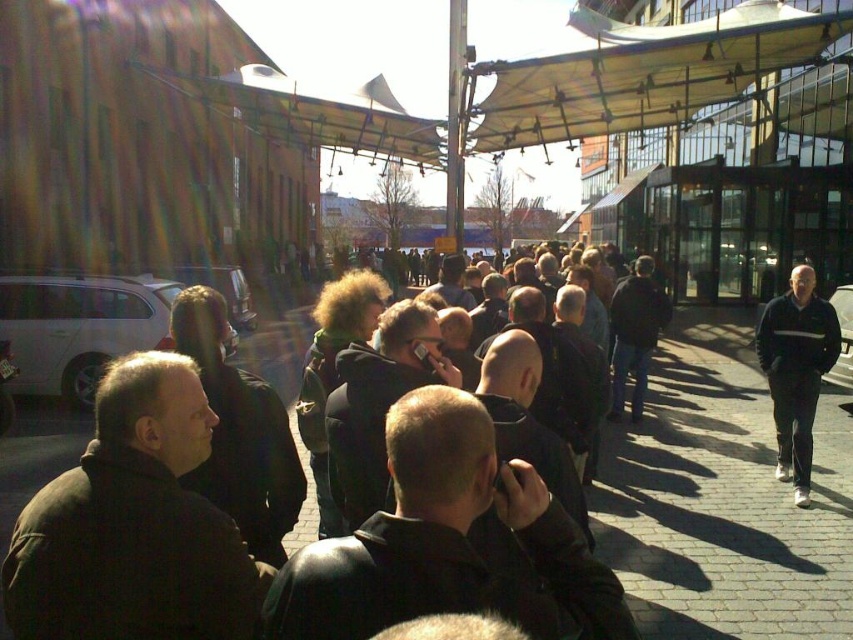
Question: Which of these objects is positioned closest to the dark brown leather jacket at center?

Choices:
 (A) brick pavement at center-right
 (B) black fabric jacket at right
 (C) beige fabric canopy at upper center

Answer: (A)

Question: Does black fabric jacket at right appear over dark brown leather jacket at center?

Choices:
 (A) yes
 (B) no

Answer: (B)

Question: Can you confirm if dark gray brick pavement at center is positioned above beige fabric canopy at upper center?

Choices:
 (A) yes
 (B) no

Answer: (B)

Question: Among these objects, which one is nearest to the camera?

Choices:
 (A) dark brown leather jacket at center
 (B) brick pavement at center-right
 (C) dark brown leather jacket at left
 (D) black fabric jacket at right

Answer: (C)

Question: Is dark gray brick pavement at center bigger than dark brown leather jacket at left?

Choices:
 (A) no
 (B) yes

Answer: (B)

Question: Which point is closer to the camera?

Choices:
 (A) dark brown leather jacket at left
 (B) beige fabric canopy at upper center
 (C) dark brown leather jacket at center
 (D) dark gray brick pavement at center

Answer: (A)